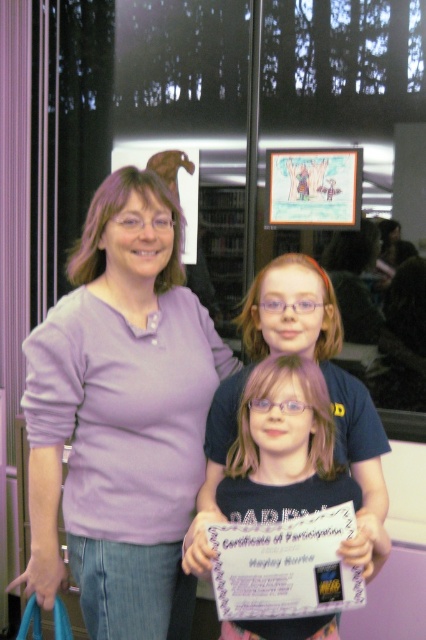
Question: Does purple cotton shirt at center lie behind matte black shirt at center?

Choices:
 (A) yes
 (B) no

Answer: (A)

Question: Does purple cotton shirt at center lie in front of matte black shirt at center?

Choices:
 (A) yes
 (B) no

Answer: (B)

Question: Can you confirm if purple cotton shirt at center is positioned below matte black shirt at center?

Choices:
 (A) yes
 (B) no

Answer: (B)

Question: Which point appears closest to the camera in this image?

Choices:
 (A) click(x=54, y=548)
 (B) click(x=316, y=502)

Answer: (B)

Question: Which of the following is the farthest from the observer?

Choices:
 (A) matte black shirt at center
 (B) purple cotton shirt at center

Answer: (B)

Question: Among these points, which one is nearest to the camera?

Choices:
 (A) (189, 429)
 (B) (264, 476)

Answer: (B)